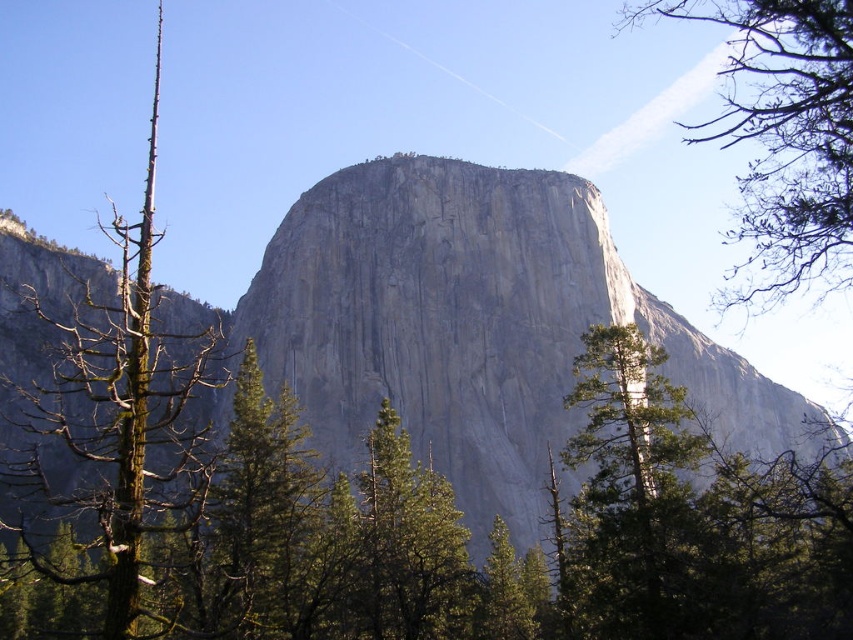
You are standing at the base of the granite rock formation and want to reach the summit. You notice two points marked on the rock face at coordinates point (544, 512) and point (111, 612). Which point is closer to the summit?

Point (544, 512) is behind point (111, 612), so it is closer to the summit since it is further along the rock face from the observer.